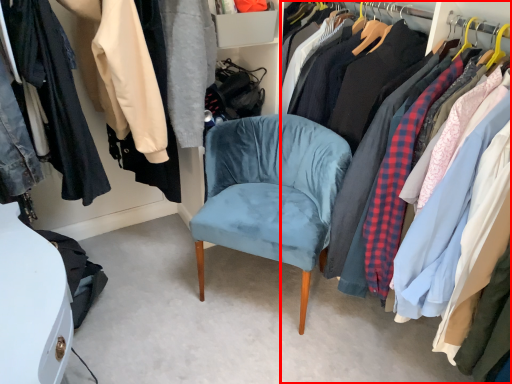
Question: From the image's perspective, where is closet (annotated by the red box) located relative to chair?

Choices:
 (A) below
 (B) above

Answer: (A)